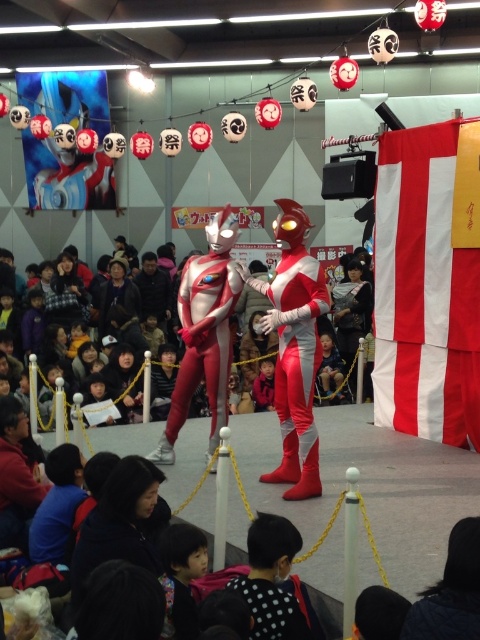
Based on the photo, measure the distance from red/white striped banner at right to silver metallic suit at center.

6.83 feet

Is red/white striped banner at right taller than silver metallic suit at center?

Indeed, red/white striped banner at right has a greater height compared to silver metallic suit at center.

The image size is (480, 640). Identify the location of red/white striped banner at right. (423, 292).

Measure the distance between point (214, 260) and camera.

Point (214, 260) is 6.41 meters from camera.

Is point (229, 310) behind point (291, 317)?

Yes.

What do you see at coordinates (204, 332) in the screenshot?
I see `silver metallic suit at center` at bounding box center [204, 332].

What are the coordinates of `silver metallic suit at center` in the screenshot? It's located at (204, 332).

Looking at this image, which of these two, red/white striped banner at right or shiny metallic suit at center, stands shorter?

Standing shorter between the two is shiny metallic suit at center.

You are a GUI agent. You are given a task and a screenshot of the screen. Output one action in this format:
    pyautogui.click(x=<x>, y=<y>)
    Task: Click on the red/white striped banner at right
    
    Given the screenshot: What is the action you would take?
    tap(423, 292)

Locate an element on the screen. The image size is (480, 640). red/white striped banner at right is located at coordinates (423, 292).